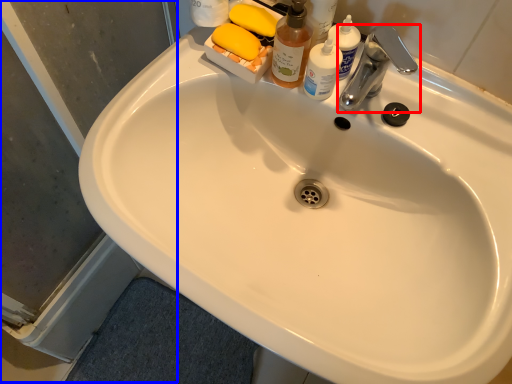
Question: Among these objects, which one is farthest to the camera, tap (highlighted by a red box) or screen door (highlighted by a blue box)?

Choices:
 (A) tap
 (B) screen door

Answer: (A)